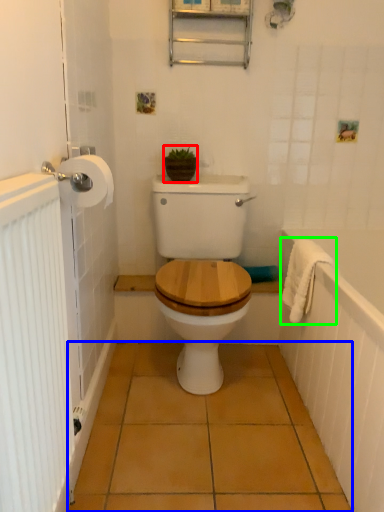
Question: Considering the real-world distances, which object is closest to plant (highlighted by a red box)? ceramic tile (highlighted by a blue box) or bath towel (highlighted by a green box).

Choices:
 (A) ceramic tile
 (B) bath towel

Answer: (B)